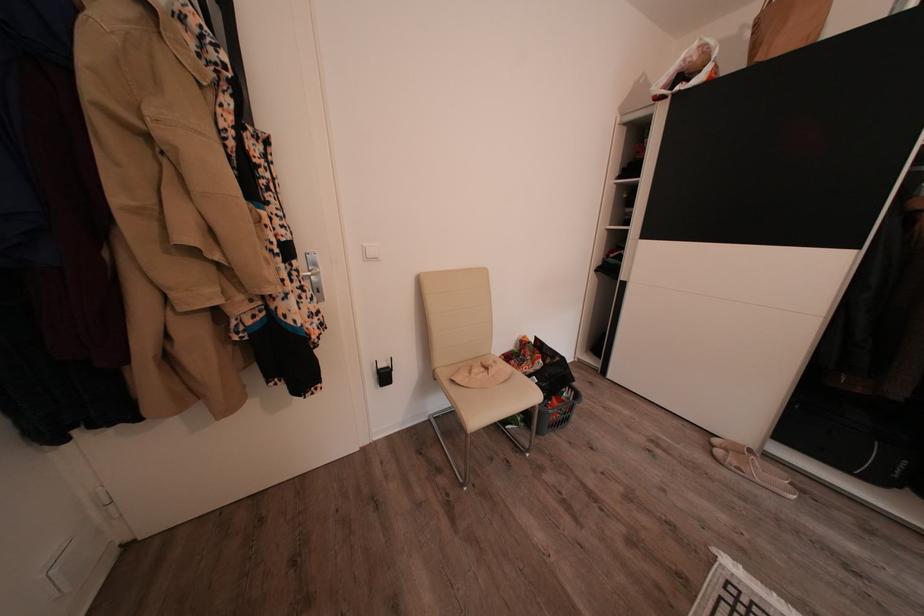
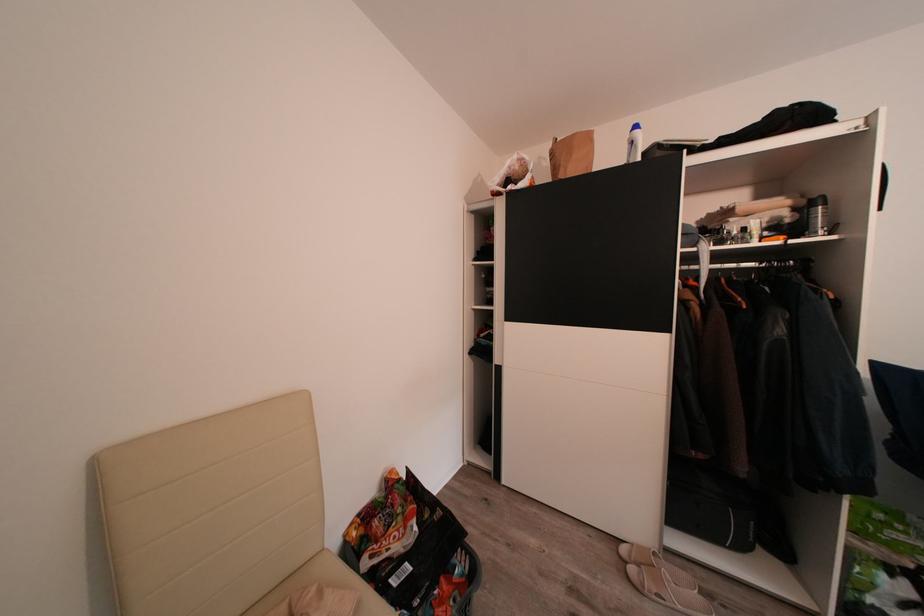
The point at (724, 447) is marked in the first image. Where is the corresponding point in the second image?

(631, 554)